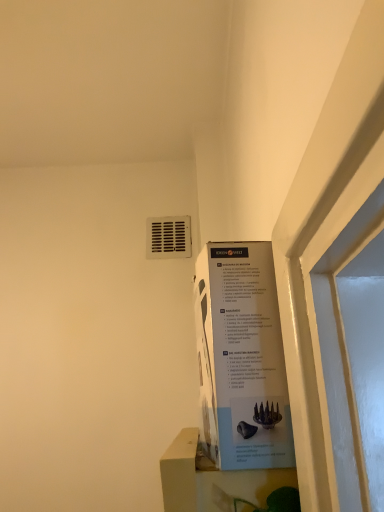
Question: From the image's perspective, is white cardboard poster at upper right under white matte window sill at lower center?

Choices:
 (A) no
 (B) yes

Answer: (A)

Question: Can you confirm if white cardboard poster at upper right is shorter than white matte window sill at lower center?

Choices:
 (A) yes
 (B) no

Answer: (B)

Question: Is the depth of white cardboard poster at upper right greater than that of white matte window sill at lower center?

Choices:
 (A) no
 (B) yes

Answer: (B)

Question: Can you confirm if white cardboard poster at upper right is positioned to the left of white matte window sill at lower center?

Choices:
 (A) yes
 (B) no

Answer: (B)

Question: Is white cardboard poster at upper right oriented away from white matte window sill at lower center?

Choices:
 (A) yes
 (B) no

Answer: (B)

Question: From a real-world perspective, is white cardboard poster at upper right beneath white matte window sill at lower center?

Choices:
 (A) no
 (B) yes

Answer: (A)

Question: Can you confirm if white plastic vent at upper center is thinner than white cardboard poster at upper right?

Choices:
 (A) yes
 (B) no

Answer: (A)

Question: Is the depth of white plastic vent at upper center greater than that of white cardboard poster at upper right?

Choices:
 (A) yes
 (B) no

Answer: (A)

Question: From a real-world perspective, does white plastic vent at upper center sit lower than white cardboard poster at upper right?

Choices:
 (A) no
 (B) yes

Answer: (A)

Question: Is white plastic vent at upper center to the left of white cardboard poster at upper right from the viewer's perspective?

Choices:
 (A) no
 (B) yes

Answer: (B)

Question: Is white cardboard poster at upper right completely or partially inside white plastic vent at upper center?

Choices:
 (A) yes
 (B) no

Answer: (B)

Question: Could you tell me if white plastic vent at upper center is turned towards white cardboard poster at upper right?

Choices:
 (A) yes
 (B) no

Answer: (B)

Question: Is white matte window sill at lower center outside of white cardboard poster at upper right?

Choices:
 (A) no
 (B) yes

Answer: (B)